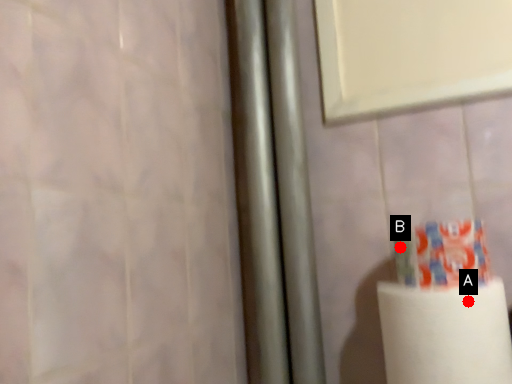
Question: Two points are circled on the image, labeled by A and B beside each circle. Which point appears farthest from the camera in this image?

Choices:
 (A) A is further
 (B) B is further

Answer: (B)